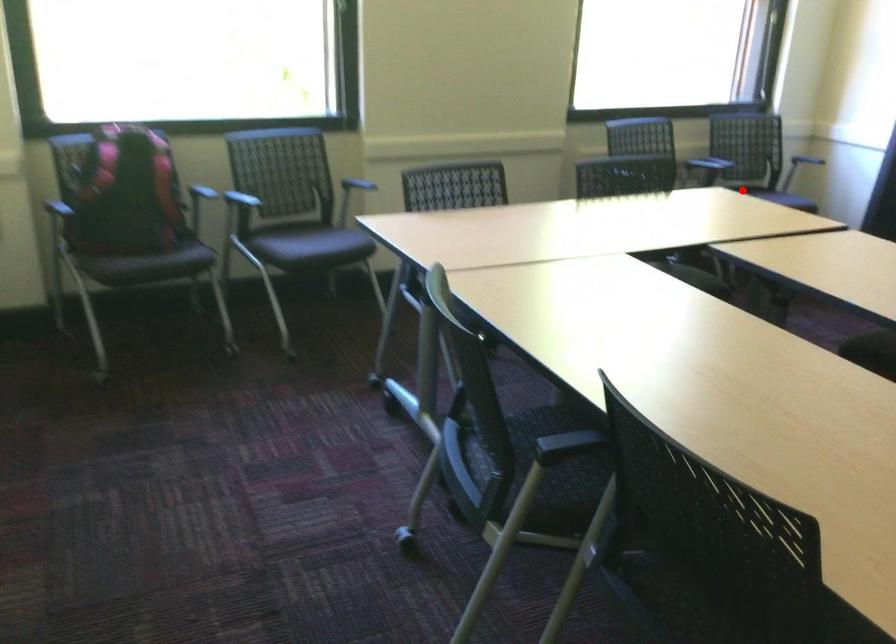
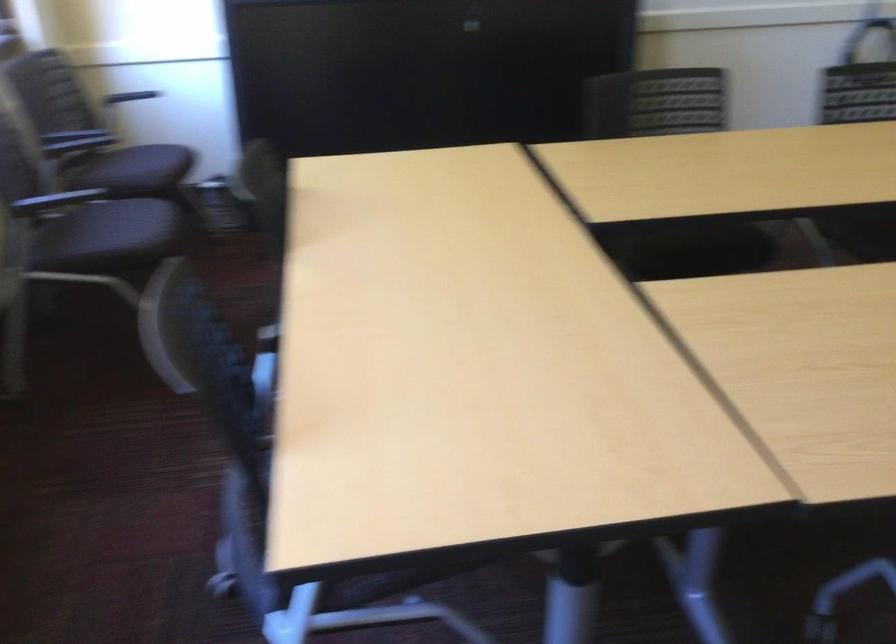
Question: I am providing you with two images of the same scene from different viewpoints. A red point is shown in image1. For the corresponding object point in image2, is it positioned nearer or farther from the camera?

Choices:
 (A) Nearer
 (B) Farther

Answer: (A)